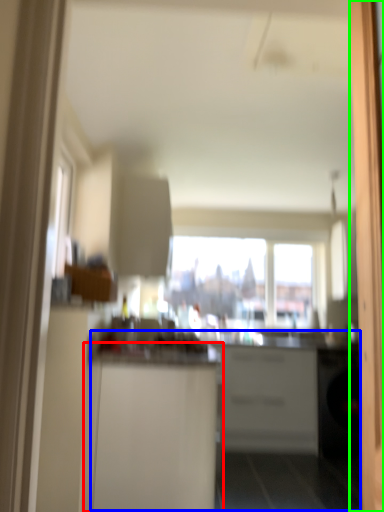
Question: Considering the real-world distances, which object is closest to cabinetry (highlighted by a red box)? counter (highlighted by a blue box) or screen door (highlighted by a green box).

Choices:
 (A) counter
 (B) screen door

Answer: (B)